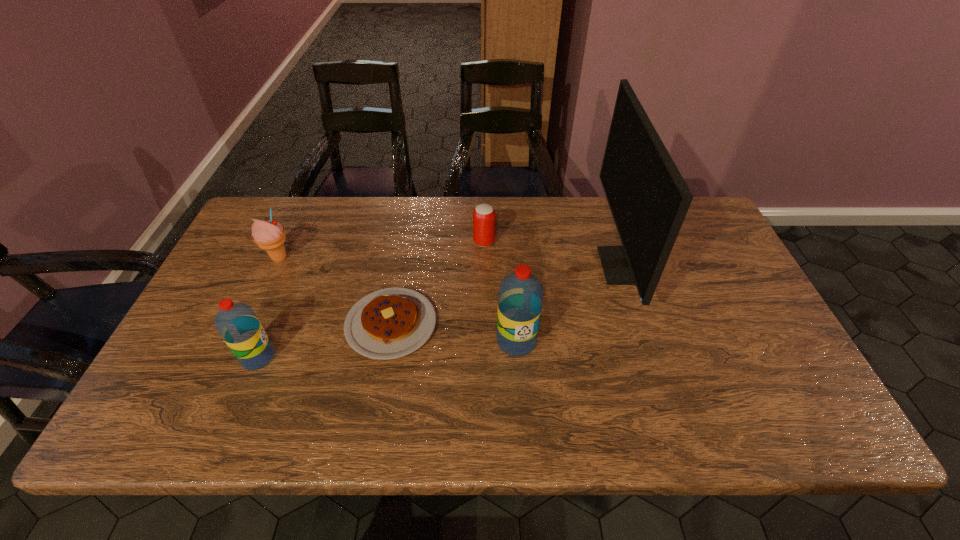
Identify the location of free location located 0.140m on the front label of the fourth shortest object. (333, 357).

Locate an element on the screen. The height and width of the screenshot is (540, 960). free spot located on the front label of the taller water bottle is located at coordinates (519, 384).

The height and width of the screenshot is (540, 960). Identify the location of free space located 0.140m on the front-facing side of the tallest object. (553, 266).

Where is `vacant space located 0.180m on the front-facing side of the tallest object`? The height and width of the screenshot is (540, 960). vacant space located 0.180m on the front-facing side of the tallest object is located at coordinates (540, 266).

Where is `vacant region located on the front-facing side of the tallest object`? Image resolution: width=960 pixels, height=540 pixels. vacant region located on the front-facing side of the tallest object is located at coordinates (566, 266).

Find the location of a particular element. This screenshot has width=960, height=540. vacant space located 0.260m on the right of the third object from left to right is located at coordinates (538, 324).

Image resolution: width=960 pixels, height=540 pixels. I want to click on free region located on the right of the fourth tallest object, so click(x=372, y=258).

Find the location of a particular element. This screenshot has height=540, width=960. blank space located on the back of the beer can is located at coordinates (484, 197).

Where is `computer monitor that is at the far edge`? computer monitor that is at the far edge is located at coordinates (648, 198).

The width and height of the screenshot is (960, 540). Identify the location of beer can that is at the far edge. (484, 215).